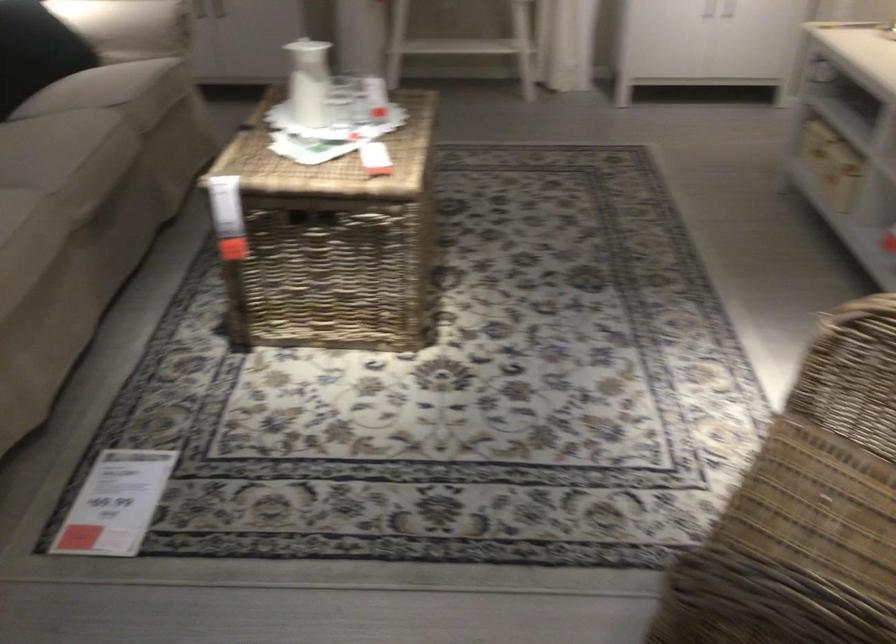
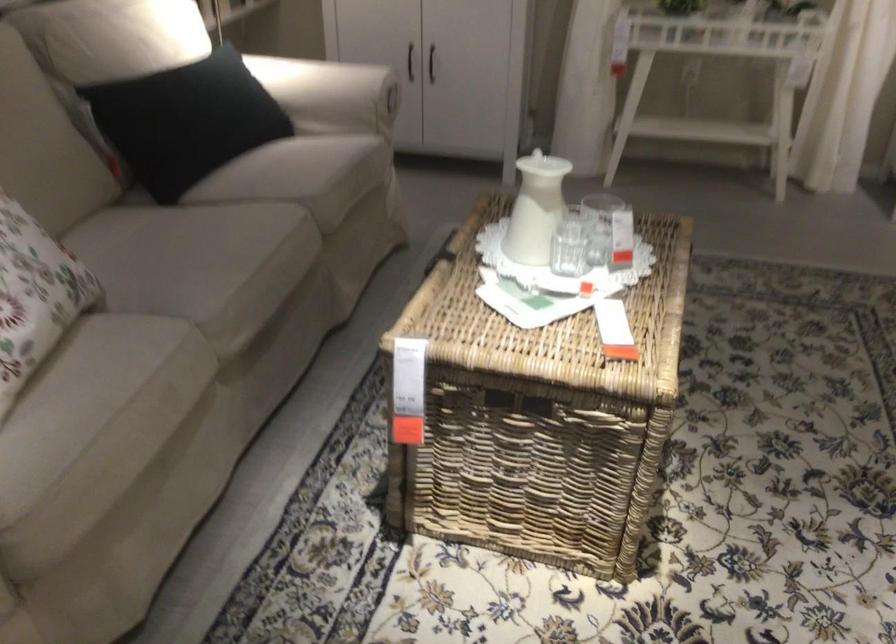
Question: The first image is from the beginning of the video and the second image is from the end. How did the camera likely rotate when shooting the video?

Choices:
 (A) Left
 (B) Right
 (C) Up
 (D) Down

Answer: (A)